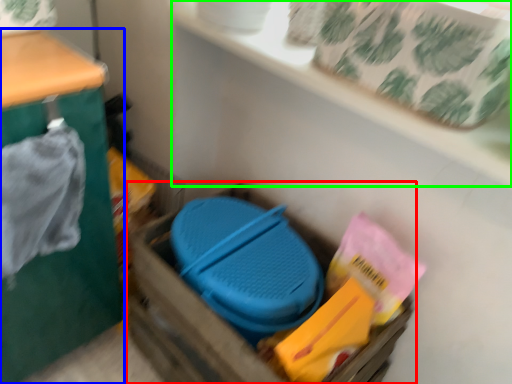
Question: Which object is positioned farthest from storage box (highlighted by a red box)? Select from furniture (highlighted by a blue box) and shelf (highlighted by a green box).

Choices:
 (A) furniture
 (B) shelf

Answer: (B)